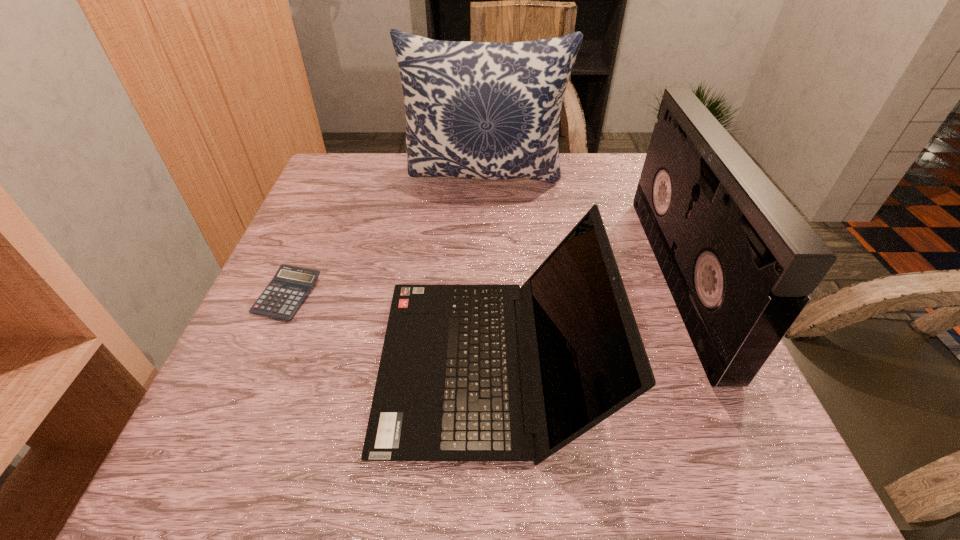
The height and width of the screenshot is (540, 960). Identify the location of blank space at the left edge. (319, 354).

Locate an element on the screen. The image size is (960, 540). vacant space at the right edge is located at coordinates (662, 288).

You are a GUI agent. You are given a task and a screenshot of the screen. Output one action in this format:
    pyautogui.click(x=<x>, y=<y>)
    Task: Click on the free space at the far left corner
    This screenshot has width=960, height=540.
    Given the screenshot: What is the action you would take?
    pyautogui.click(x=355, y=167)

Identify the location of blank area at the near left corner. The width and height of the screenshot is (960, 540). (283, 453).

In the image, there is a desktop. Identify the location of blank space at the far right corner. (621, 159).

Where is `free location at the near right corner`? free location at the near right corner is located at coordinates (756, 441).

Find the location of a particular element. The width and height of the screenshot is (960, 540). free space between the cushion and the laptop computer is located at coordinates (487, 272).

Locate an element on the screen. This screenshot has height=540, width=960. object identified as the closest to the farthest object is located at coordinates (739, 260).

Identify which object is the third nearest to the second shortest object. Please provide its 2D coordinates. Your answer should be formatted as a tuple, i.e. [(x, y)], where the tuple contains the x and y coordinates of a point satisfying the conditions above.

[(480, 110)]